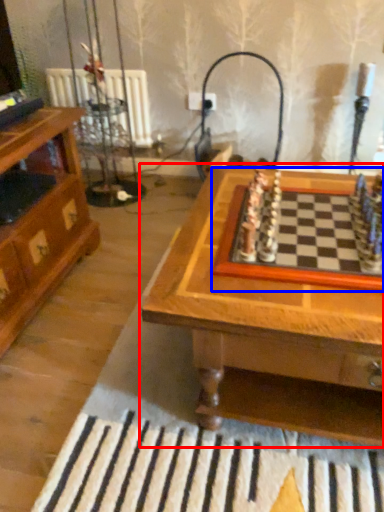
Question: Which object appears closest to the camera in this image, table (highlighted by a red box) or board game (highlighted by a blue box)?

Choices:
 (A) table
 (B) board game

Answer: (A)